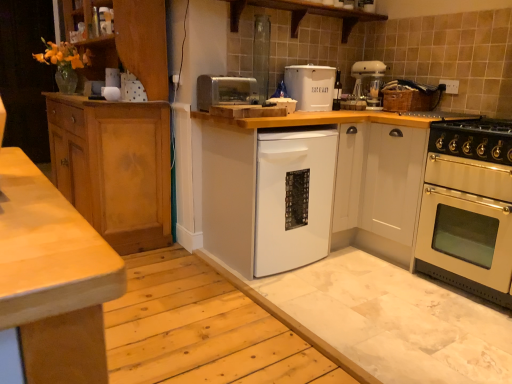
Find the location of `stainless steel oven at right`. stainless steel oven at right is located at coordinates (468, 209).

Locate an element on the screen. The image size is (512, 384). light brown wood cabinet at left, marked as the first cabinetry in a left-to-right arrangement is located at coordinates (114, 167).

What is the approximate height of white plastic mixer at upper right?

white plastic mixer at upper right is 13.94 inches in height.

Locate an element on the screen. The height and width of the screenshot is (384, 512). white matte dishwasher at center, arranged as the second cabinetry when viewed from the right is located at coordinates (335, 186).

Looking at this image, would you say wooden at upper center is a long distance from white matte bread bin at center?

They are positioned close to each other.

Can you tell me how much wooden at upper center and white matte bread bin at center differ in facing direction?

They differ by 0.997 degrees in their facing directions.

Considering the positions of objects wooden at upper center and white matte bread bin at center in the image provided, who is more to the right, wooden at upper center or white matte bread bin at center?

white matte bread bin at center.

Considering the sizes of objects wooden at upper center and white matte bread bin at center in the image provided, who is smaller, wooden at upper center or white matte bread bin at center?

Smaller between the two is white matte bread bin at center.

Is stainless steel oven at right in front of or behind light brown wood cabinet at left, the 3th cabinetry when ordered from right to left, in the image?

stainless steel oven at right is positioned closer to the viewer than light brown wood cabinet at left, the 3th cabinetry when ordered from right to left.

Considering the relative sizes of stainless steel oven at right and light brown wood cabinet at left, marked as the first cabinetry in a left-to-right arrangement, in the image provided, is stainless steel oven at right bigger than light brown wood cabinet at left, marked as the first cabinetry in a left-to-right arrangement,?

Actually, stainless steel oven at right might be smaller than light brown wood cabinet at left, marked as the first cabinetry in a left-to-right arrangement.

Is stainless steel oven at right thinner than light brown wood cabinet at left, marked as the first cabinetry in a left-to-right arrangement?

No, stainless steel oven at right is not thinner than light brown wood cabinet at left, marked as the first cabinetry in a left-to-right arrangement.

From the picture: From a real-world perspective, is white matte bread bin at center located higher than white matte dishwasher at center?

Yes, from a real-world perspective, white matte bread bin at center is above white matte dishwasher at center.

Is white matte bread bin at center placed right next to white matte dishwasher at center?

No, white matte bread bin at center is not with white matte dishwasher at center.

Can you confirm if white matte bread bin at center is wider than white matte dishwasher at center?

No, white matte bread bin at center is not wider than white matte dishwasher at center.

The width and height of the screenshot is (512, 384). In order to click on kitchen appliance above the white matte dishwasher at center (from a real-world perspective) in this screenshot , I will do `click(310, 86)`.

From the wooden at upper center, count 2nd cabinetry to the right and point to it. Please provide its 2D coordinates.

[(391, 191)]

Which of these two, white glossy cabinet at right, the third cabinetry viewed from the left, or wooden at upper center, is smaller?

Smaller between the two is wooden at upper center.

Considering the sizes of objects white glossy cabinet at right, acting as the 1th cabinetry starting from the right, and wooden at upper center in the image provided, who is taller, white glossy cabinet at right, acting as the 1th cabinetry starting from the right, or wooden at upper center?

white glossy cabinet at right, acting as the 1th cabinetry starting from the right.

From a real-world perspective, between white matte bread bin at center and white plastic mixer at upper right, who is vertically higher?

white plastic mixer at upper right, from a real-world perspective.

Is white matte bread bin at center behind white plastic mixer at upper right?

No, the depth of white matte bread bin at center is less than that of white plastic mixer at upper right.

Looking at this image, can you confirm if white matte bread bin at center is positioned to the right of white plastic mixer at upper right?

Incorrect, white matte bread bin at center is not on the right side of white plastic mixer at upper right.

Is white plastic mixer at upper right oriented away from stainless steel oven at right?

No, white plastic mixer at upper right's orientation is not away from stainless steel oven at right.

From the image's perspective, which object appears higher, white plastic mixer at upper right or stainless steel oven at right?

From the image's view, white plastic mixer at upper right is above.

Which point is more distant from viewer, [375,100] or [447,143]?

The point [375,100] is farther.

Considering the positions of point (352, 73) and point (319, 247), is point (352, 73) closer or farther from the camera than point (319, 247)?

Point (352, 73).

Find the location of a particular element. This screenshot has width=512, height=384. coffee machine behind the white matte dishwasher at center is located at coordinates (368, 81).

From the picture: From the image's perspective, which one is positioned higher, white plastic mixer at upper right or white matte dishwasher at center?

white plastic mixer at upper right is shown above in the image.

Is white plastic mixer at upper right to the left or to the right of white matte dishwasher at center in the image?

In the image, white plastic mixer at upper right appears on the right side of white matte dishwasher at center.

The width and height of the screenshot is (512, 384). In order to click on shelf to the left of white matte bread bin at center in this screenshot , I will do `click(304, 14)`.

From the image's perspective, starting from the stainless steel oven at right, which cabinetry is the 3rd one above? Please provide its 2D coordinates.

[(114, 167)]

Which object lies further to the anchor point white matte dishwasher at center, white glossy cabinet at right, the third cabinetry viewed from the left, or white matte dishwasher at center, arranged as the second cabinetry when viewed from the right?

white glossy cabinet at right, the third cabinetry viewed from the left, lies further to white matte dishwasher at center than the other object.

Looking at the image, which one is located closer to white matte dishwasher at center, which appears as the 2th cabinetry when viewed from the left, white matte bread bin at center or gold metallic gas stove at right?

gold metallic gas stove at right lies closer to white matte dishwasher at center, which appears as the 2th cabinetry when viewed from the left, than the other object.

Estimate the real-world distances between objects in this image. Which object is closer to stainless steel oven at right, silver metallic toaster at center or white glossy cabinet at right, acting as the 1th cabinetry starting from the right?

white glossy cabinet at right, acting as the 1th cabinetry starting from the right, is closer to stainless steel oven at right.

Considering their positions, is silver metallic toaster at center positioned closer to white glossy cabinet at right, the third cabinetry viewed from the left, than stainless steel oven at right?

The object closer to white glossy cabinet at right, the third cabinetry viewed from the left, is stainless steel oven at right.

Looking at the image, which one is located closer to white glossy cabinet at right, acting as the 1th cabinetry starting from the right, wooden at upper center or white plastic mixer at upper right?

white plastic mixer at upper right lies closer to white glossy cabinet at right, acting as the 1th cabinetry starting from the right, than the other object.

Based on their spatial positions, is white matte dishwasher at center, which appears as the 2th cabinetry when viewed from the left, or white matte dishwasher at center further from wooden at upper center?

Among the two, white matte dishwasher at center is located further to wooden at upper center.

From the image, which object appears to be nearer to gold metallic gas stove at right, silver metallic toaster at center or white matte bread bin at center?

Based on the image, white matte bread bin at center appears to be nearer to gold metallic gas stove at right.

Looking at the image, which one is located further to stainless steel oven at right, silver metallic toaster at center or white matte dishwasher at center?

Based on the image, silver metallic toaster at center appears to be further to stainless steel oven at right.

I want to click on dish washer between light brown wood cabinet at left, marked as the first cabinetry in a left-to-right arrangement, and white matte dishwasher at center, arranged as the second cabinetry when viewed from the right, from left to right, so click(293, 198).

Where is `coffee machine that lies between wooden at upper center and stainless steel oven at right from top to bottom`? The height and width of the screenshot is (384, 512). coffee machine that lies between wooden at upper center and stainless steel oven at right from top to bottom is located at coordinates (368, 81).

This screenshot has width=512, height=384. Identify the location of shelf situated between light brown wood cabinet at left, marked as the first cabinetry in a left-to-right arrangement, and stainless steel oven at right from left to right. (304, 14).

Image resolution: width=512 pixels, height=384 pixels. Find the location of `appliance located between white matte dishwasher at center, arranged as the second cabinetry when viewed from the right, and white plastic mixer at upper right in the depth direction`. appliance located between white matte dishwasher at center, arranged as the second cabinetry when viewed from the right, and white plastic mixer at upper right in the depth direction is located at coordinates (225, 91).